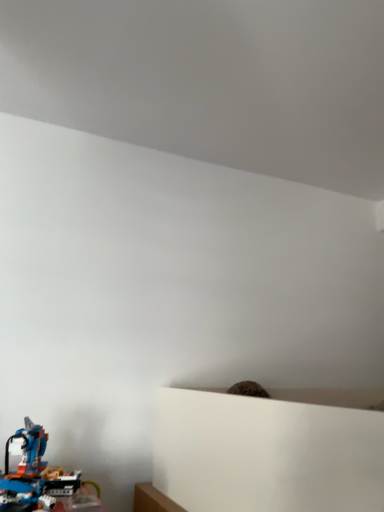
Describe the element at coordinates (42, 478) in the screenshot. Image resolution: width=384 pixels, height=512 pixels. I see `blue plastic toy at lower left` at that location.

At what (x,y) coordinates should I click in order to perform the action: click on blue plastic toy at lower left. Please return your answer as a coordinate pair (x, y). Looking at the image, I should click on (42, 478).

This screenshot has width=384, height=512. I want to click on blue plastic toy at lower left, so click(42, 478).